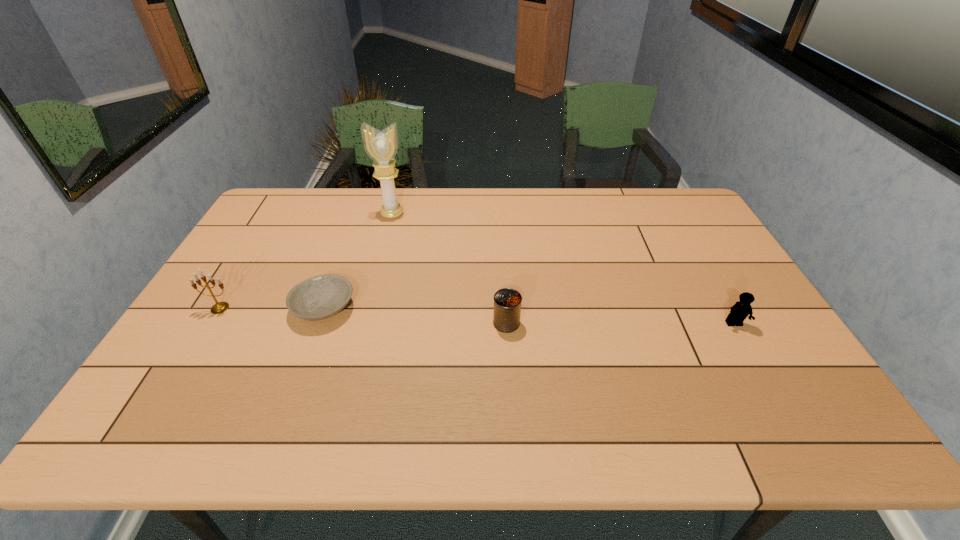
Find the location of a particular element. vacant region at the far right corner is located at coordinates (684, 191).

Find the location of a particular element. empty space between the candelabrum and the bowl is located at coordinates (272, 308).

Where is `unoccupied position between the candelabrum and the rightmost object`? unoccupied position between the candelabrum and the rightmost object is located at coordinates (477, 316).

Locate an element on the screen. This screenshot has height=540, width=960. free space between the farthest object and the leftmost object is located at coordinates (306, 261).

Locate an element on the screen. The height and width of the screenshot is (540, 960). vacant point located between the bowl and the Lego is located at coordinates (529, 316).

I want to click on vacant region between the bowl and the candelabrum, so click(x=272, y=308).

I want to click on free space between the candelabrum and the rightmost object, so click(477, 316).

Find the location of `free space between the shortest object and the tallest object`. free space between the shortest object and the tallest object is located at coordinates (358, 261).

The image size is (960, 540). I want to click on free space that is in between the fourth object from left to right and the shortest object, so click(x=415, y=315).

Locate an element on the screen. vacant space that's between the second tallest object and the Lego is located at coordinates (477, 316).